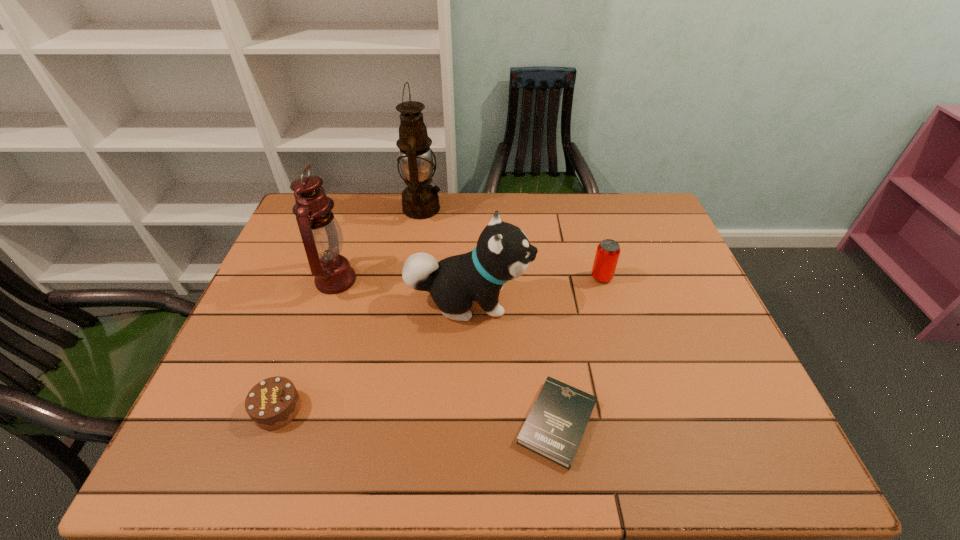
Image resolution: width=960 pixels, height=540 pixels. In order to click on free location located 0.230m on the back of the fifth shortest object in this screenshot , I will do `click(358, 215)`.

The height and width of the screenshot is (540, 960). Identify the location of vacant region located at the face of the puppy. (598, 301).

Identify the location of free space located on the back of the fourth tallest object. (593, 248).

You are a GUI agent. You are given a task and a screenshot of the screen. Output one action in this format:
    pyautogui.click(x=<x>, y=<y>)
    Task: Click on the free space located on the left of the chocolate cake
    This screenshot has width=960, height=540.
    Given the screenshot: What is the action you would take?
    pyautogui.click(x=227, y=409)

Find the location of a particular element. blank area located on the back of the shortest object is located at coordinates (537, 269).

This screenshot has height=540, width=960. In order to click on object that is positioned at the far edge in this screenshot , I will do `click(420, 200)`.

Identify the location of chocolate cake positioned at the near edge. (274, 402).

The height and width of the screenshot is (540, 960). What are the coordinates of `book at the near edge` in the screenshot? It's located at (554, 428).

At what (x,y) coordinates should I click in order to perform the action: click on oil lamp located in the left edge section of the desktop. Please return your answer as a coordinate pair (x, y). Looking at the image, I should click on (322, 237).

Where is `chocolate cake that is at the left edge`? Image resolution: width=960 pixels, height=540 pixels. chocolate cake that is at the left edge is located at coordinates (274, 402).